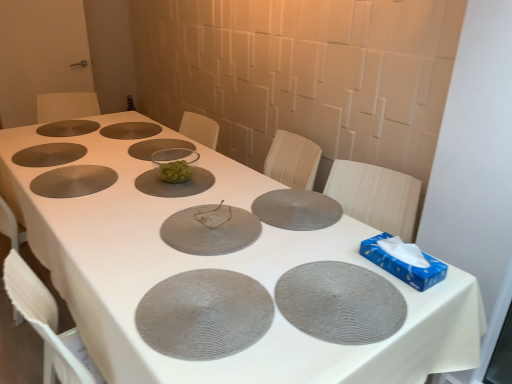
Identify the location of empty space that is in between matte gray placemat at left, which appears as the fifth glass plate when viewed from the front, and gray textured placemat at center, marked as the 1th glass plate in a front-to-back arrangement. [113, 225].